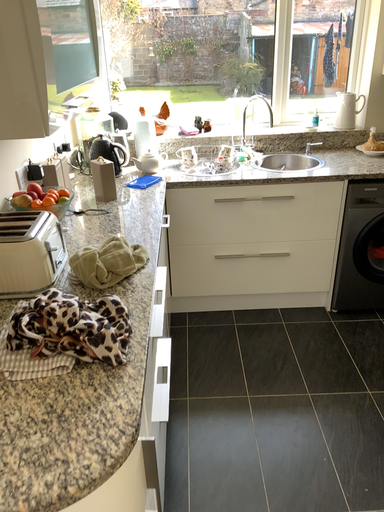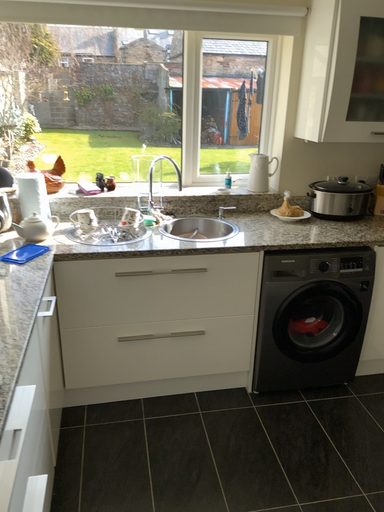
Question: How did the camera likely rotate when shooting the video?

Choices:
 (A) rotated right
 (B) rotated left

Answer: (A)